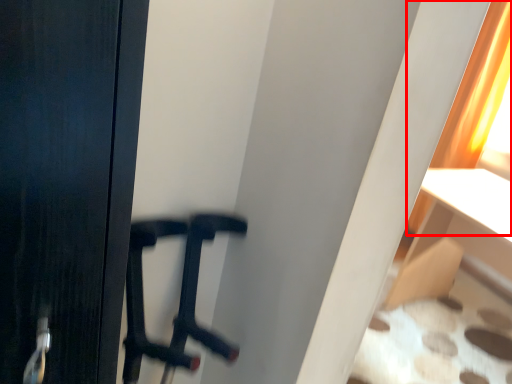
Question: From the image's perspective, where is curtain (annotated by the red box) located in relation to furniture in the image?

Choices:
 (A) below
 (B) above

Answer: (B)